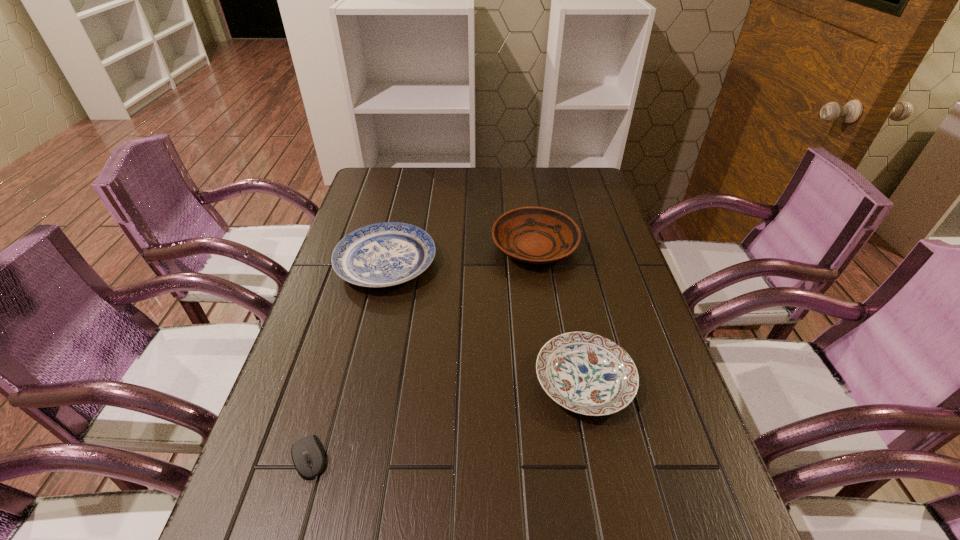
Find the location of `computer equipment at the left edge`. computer equipment at the left edge is located at coordinates (308, 455).

Find the location of a particular element. The width and height of the screenshot is (960, 540). free point at the far edge is located at coordinates (537, 169).

Identify the location of free space at the left edge. The image size is (960, 540). (260, 530).

I want to click on free point at the right edge, so click(x=618, y=292).

This screenshot has width=960, height=540. Identify the location of vacant area at the far left corner. (397, 193).

Image resolution: width=960 pixels, height=540 pixels. Find the location of `vacant space that is in between the leftmost plate and the tallest plate`. vacant space that is in between the leftmost plate and the tallest plate is located at coordinates coord(461,255).

At what (x,y) coordinates should I click in order to perform the action: click on vacant area between the shortest object and the tallest object. Please return your answer as a coordinate pair (x, y). This screenshot has width=960, height=540. Looking at the image, I should click on (422, 352).

At what (x,y) coordinates should I click in order to perform the action: click on unoccupied area between the tallest object and the nearest plate. Please return your answer as a coordinate pair (x, y). This screenshot has height=540, width=960. Looking at the image, I should click on (560, 314).

I want to click on free space between the tallest plate and the shortest object, so click(422, 352).

This screenshot has height=540, width=960. Identify the location of free space between the second nearest object and the leftmost plate. (485, 322).